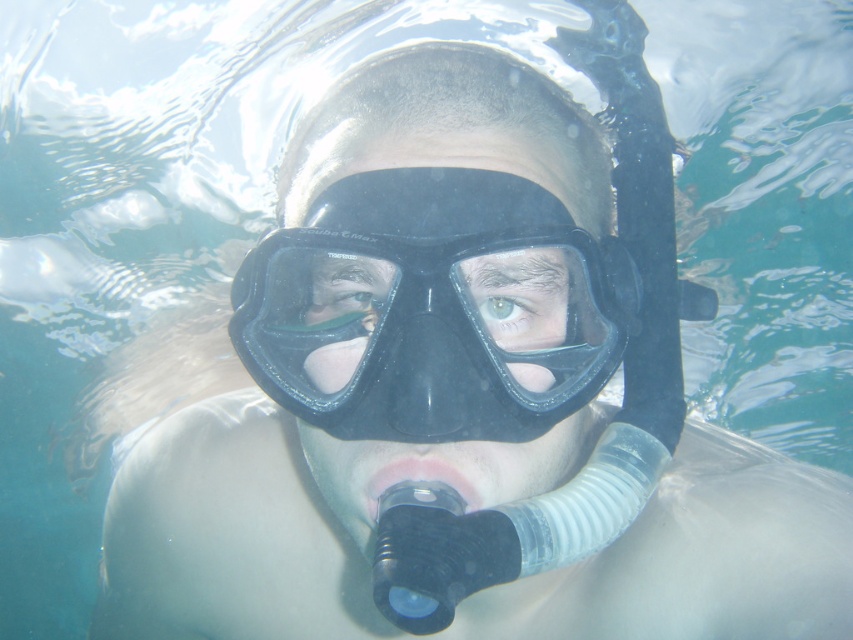
You are an underwater photographer trying to capture a clear image of the green matte eye at center. The black rubber goggles at center are in the way. Can you adjust your angle to avoid the goggles and still see the eye?

The black rubber goggles at center might be wider than green matte eye at center, so adjusting your angle might not be possible without losing sight of the eye.

You are a scuba diver preparing to descend underwater. You notice the black rubber goggles at center and the green matte eye at center. Which object is closer to you when looking straight ahead?

The black rubber goggles at center is closer to you because it is in front of the green matte eye at center.

You are a scuba diver preparing to dive into the water. You need to place your hand at a point that is exactly 24.65 inches away from you. Given the coordinates of point point (604, 346) in the image, can you determine if placing your hand there will be at the correct distance?

The distance of point point (604, 346) from viewer is 24.65 inches, so placing your hand there will be at the correct distance.